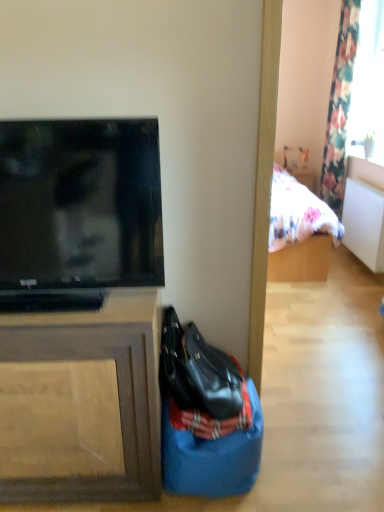
I want to click on vacant area that lies to the right of blue fabric sack at lower center, so click(x=303, y=458).